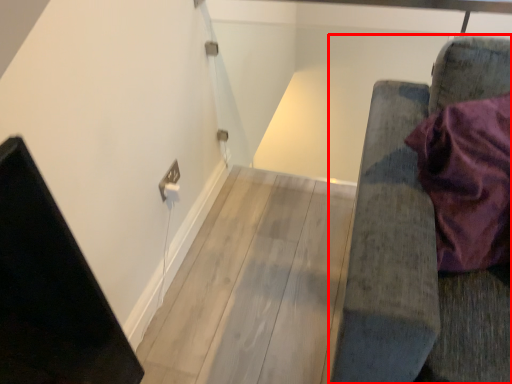
Question: Considering the relative positions of furniture (annotated by the red box) and electric outlet in the image provided, where is furniture (annotated by the red box) located with respect to the staircase?

Choices:
 (A) left
 (B) right

Answer: (B)